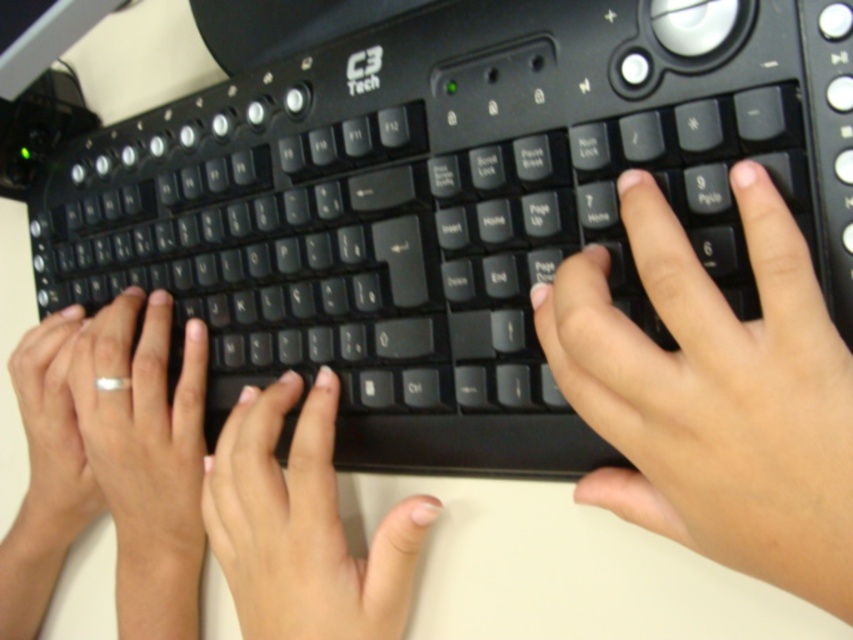
Question: Which of the following is the farthest from the observer?

Choices:
 (A) (810, 308)
 (B) (189, 529)

Answer: (B)

Question: Is black matte keyboard at center further to camera compared to white matte ring at left?

Choices:
 (A) yes
 (B) no

Answer: (B)

Question: Estimate the real-world distances between objects in this image. Which object is farther from the white matte ring at left?

Choices:
 (A) black matte hand at right
 (B) silver metallic ring at left
 (C) matte black fingers at center

Answer: (A)

Question: Based on their relative distances, which object is nearer to the black matte keyboard at center?

Choices:
 (A) matte black fingers at center
 (B) silver metallic ring at left
 (C) black matte hand at right

Answer: (A)

Question: Can you confirm if silver metallic ring at left is positioned above white matte ring at left?

Choices:
 (A) yes
 (B) no

Answer: (A)

Question: Is black matte keyboard at center smaller than matte black fingers at center?

Choices:
 (A) no
 (B) yes

Answer: (A)